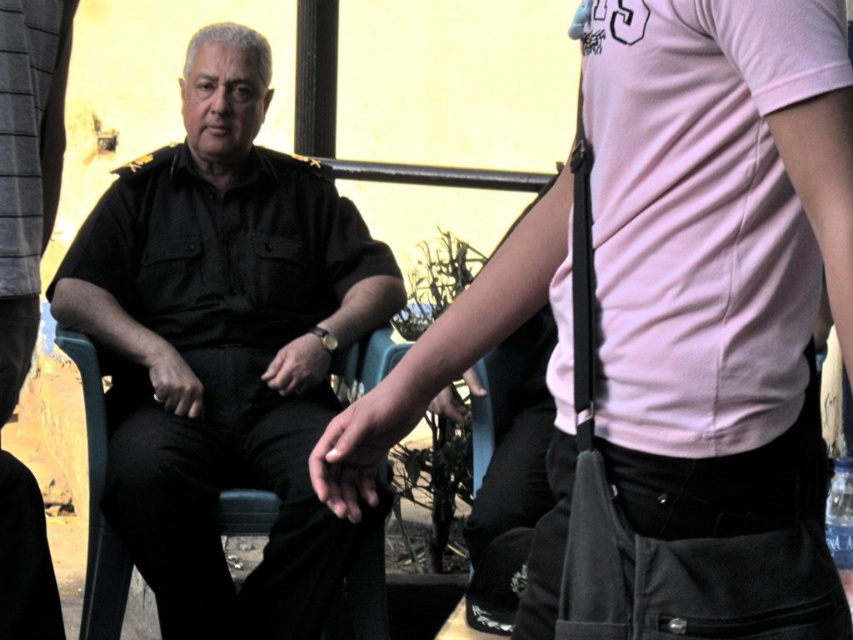
In the scene shown: Is pink matte shirt at center to the right of black uniform at center from the viewer's perspective?

Correct, you'll find pink matte shirt at center to the right of black uniform at center.

Is pink matte shirt at center behind black uniform at center?

No, pink matte shirt at center is in front of black uniform at center.

Find the location of a particular element. This screenshot has width=853, height=640. pink matte shirt at center is located at coordinates (714, 244).